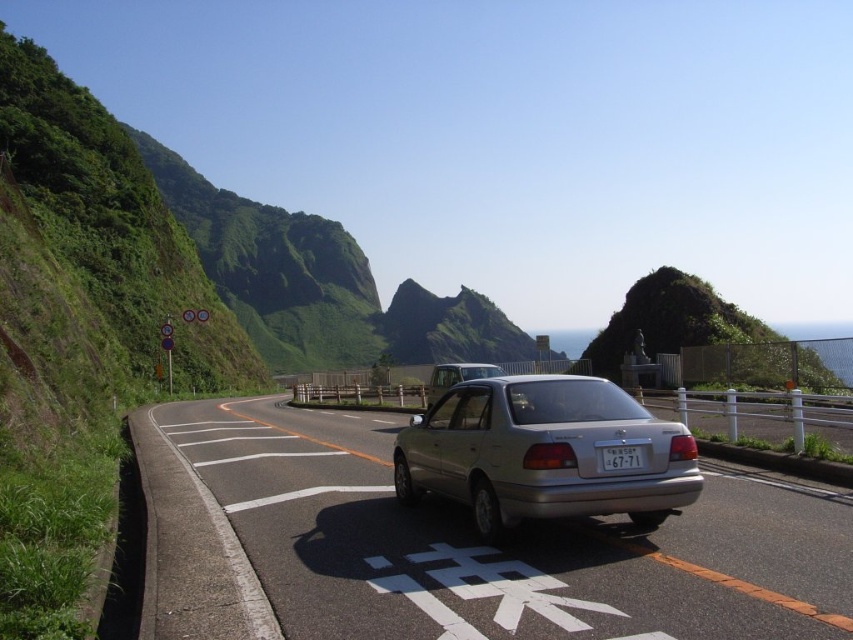
Is point (798, 625) closer to viewer compared to point (491, 376)?

Yes, point (798, 625) is in front of point (491, 376).

Which is in front, point (529, 627) or point (489, 369)?

Point (529, 627) is in front.

Locate an element on the screen. silver metallic car at center is located at coordinates (497, 548).

Does silver metallic car at center have a greater width compared to white plastic license plate at center?

Yes, silver metallic car at center is wider than white plastic license plate at center.

Does silver metallic car at center have a smaller size compared to white plastic license plate at center?

Actually, silver metallic car at center might be larger than white plastic license plate at center.

Locate an element on the screen. silver metallic car at center is located at coordinates (497, 548).

Between point (410, 522) and point (579, 388), which one is positioned behind?

Point (410, 522)

Can you confirm if silver metallic car at center is smaller than metallic silver car at center?

Actually, silver metallic car at center might be larger than metallic silver car at center.

Is point (451, 636) behind point (521, 387)?

No, it is not.

Find the location of a particular element. Image resolution: width=853 pixels, height=640 pixels. silver metallic car at center is located at coordinates (497, 548).